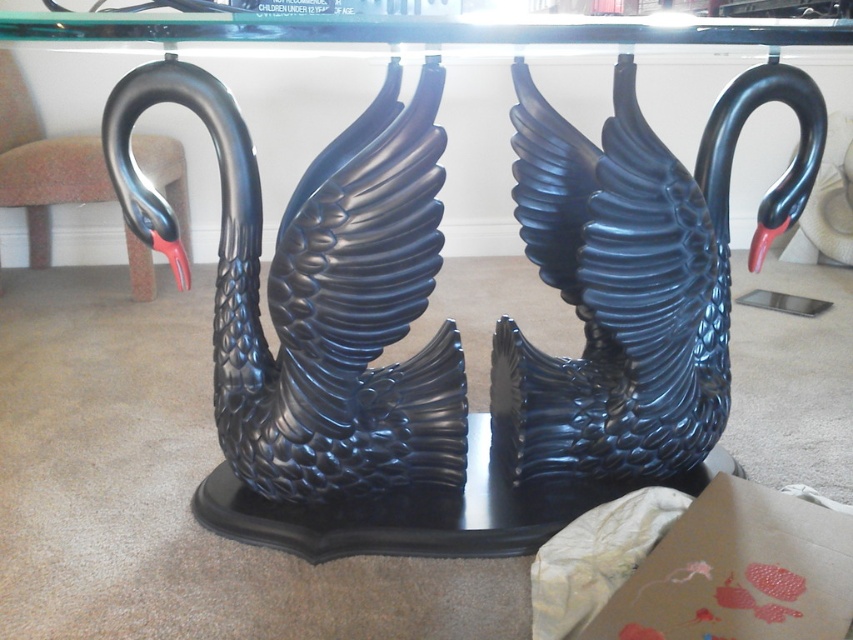
Question: Does glossy black swan at left have a lesser width compared to glossy black swan at center?

Choices:
 (A) yes
 (B) no

Answer: (B)

Question: Among these objects, which one is nearest to the camera?

Choices:
 (A) glossy black swan at left
 (B) glossy black swan at center

Answer: (A)

Question: From the image, what is the correct spatial relationship of glossy black swan at left in relation to glossy black swan at center?

Choices:
 (A) left
 (B) right

Answer: (A)

Question: Which object appears closest to the camera in this image?

Choices:
 (A) glossy black swan at center
 (B) glossy black swan at left

Answer: (B)

Question: Is glossy black swan at left further to camera compared to glossy black swan at center?

Choices:
 (A) no
 (B) yes

Answer: (A)